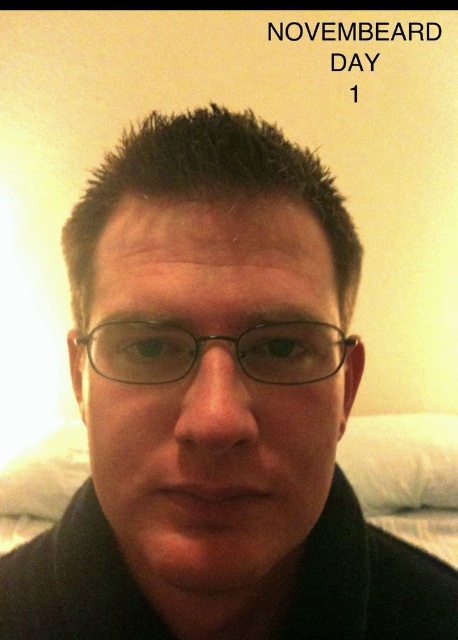
In the scene shown: Does matte black glasses at center have a lesser height compared to black plastic glasses at center?

No.

Is matte black glasses at center closer to the viewer compared to black plastic glasses at center?

Yes, it is in front of black plastic glasses at center.

This screenshot has width=458, height=640. What are the coordinates of `matte black glasses at center` in the screenshot? It's located at (207, 388).